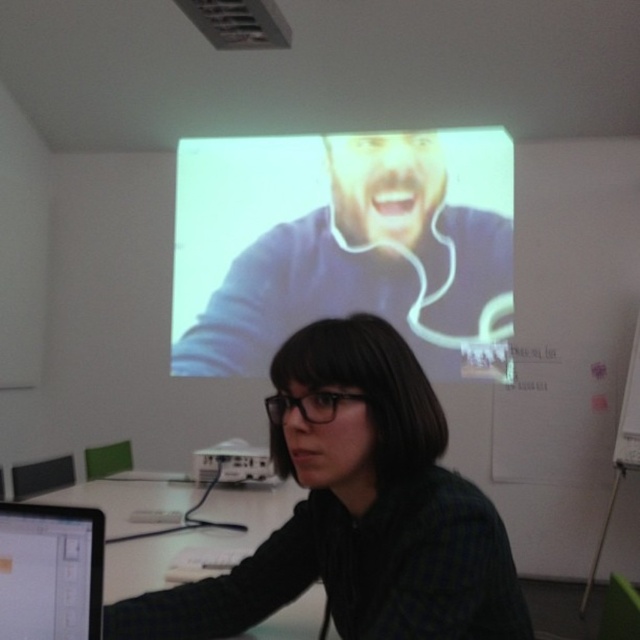
Is matte black monitor at lower left smaller than white plastic projector at center?

Correct, matte black monitor at lower left occupies less space than white plastic projector at center.

Does matte black monitor at lower left come in front of white plastic projector at center?

Yes, it is.

Measure the distance between point (29, 566) and camera.

A distance of 35.96 inches exists between point (29, 566) and camera.

Locate an element on the screen. matte black monitor at lower left is located at coordinates (51, 572).

Who is positioned more to the right, black matte shirt at center or matte black monitor at lower left?

black matte shirt at center is more to the right.

Does point (390, 554) come farther from viewer compared to point (45, 506)?

That is True.

At what (x,y) coordinates should I click in order to perform the action: click on black matte shirt at center. Please return your answer as a coordinate pair (x, y). The height and width of the screenshot is (640, 640). Looking at the image, I should click on (356, 509).

Does point (243, 230) lie behind point (392, 611)?

Yes, point (243, 230) is behind point (392, 611).

In the scene shown: Can you confirm if white glossy screen at upper center is wider than black matte shirt at center?

Yes.

Does point (371, 138) come in front of point (285, 452)?

No.

The height and width of the screenshot is (640, 640). Identify the location of white glossy screen at upper center. (346, 244).